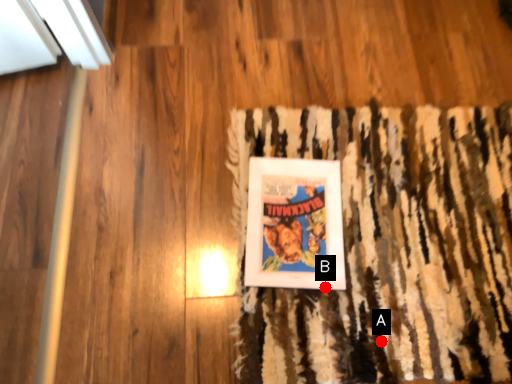
Question: Two points are circled on the image, labeled by A and B beside each circle. Which point appears farthest from the camera in this image?

Choices:
 (A) A is further
 (B) B is further

Answer: (B)